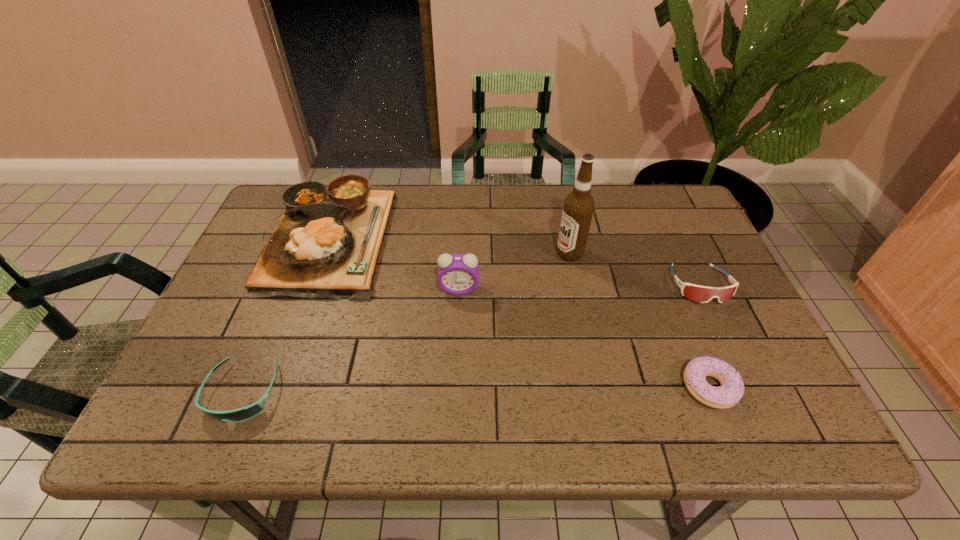
Identify which object is the second closest to the sunglasses. Please provide its 2D coordinates. Your answer should be formatted as a tuple, i.e. [(x, y)], where the tuple contains the x and y coordinates of a point satisfying the conditions above.

[(458, 274)]

Image resolution: width=960 pixels, height=540 pixels. What are the coordinates of `object that is the second closest to the third object from left to right` in the screenshot? It's located at (578, 207).

The height and width of the screenshot is (540, 960). Find the location of `free space that satisfies the following two spatial constraints: 1. on the face of the doughnut; 2. on the left side of the fourth object from right to left`. free space that satisfies the following two spatial constraints: 1. on the face of the doughnut; 2. on the left side of the fourth object from right to left is located at coordinates (455, 387).

Identify the location of vacant space that satisfies the following two spatial constraints: 1. on the label of the third object from right to left; 2. on the back side of the doughnut. (597, 387).

Where is `vacant point that satisfies the following two spatial constraints: 1. on the label of the doughnut; 2. on the right side of the alcohol`? vacant point that satisfies the following two spatial constraints: 1. on the label of the doughnut; 2. on the right side of the alcohol is located at coordinates (597, 387).